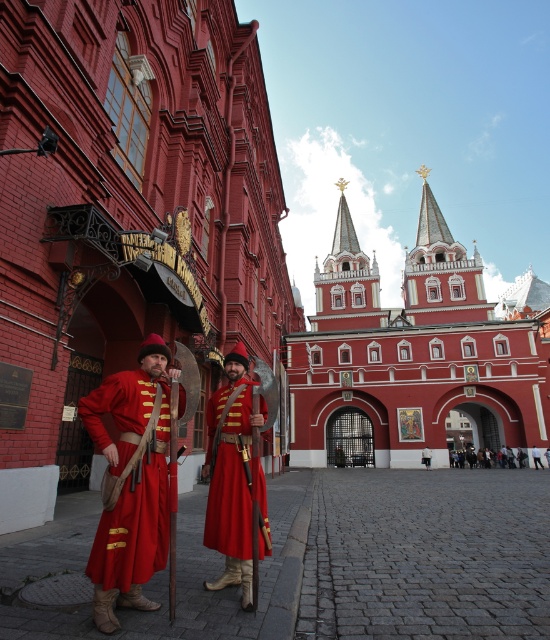
Question: Does matte red robe at center appear on the left side of red velvet coat at center?

Choices:
 (A) yes
 (B) no

Answer: (A)

Question: Based on their relative distances, which object is nearer to the red velvet coat at center?

Choices:
 (A) matte red robe at center
 (B) matte red fabric at left

Answer: (A)

Question: Which of the following is the farthest from the observer?

Choices:
 (A) tap(540, 465)
 (B) tap(46, 152)

Answer: (A)

Question: Observing the image, what is the correct spatial positioning of smooth red stone gate at center in reference to matte red fabric at left?

Choices:
 (A) left
 (B) right

Answer: (B)

Question: Does matte red robe at center have a larger size compared to red velvet coat at center?

Choices:
 (A) yes
 (B) no

Answer: (B)

Question: Which point is closer to the camera?

Choices:
 (A) pos(209,22)
 (B) pos(128,589)

Answer: (B)